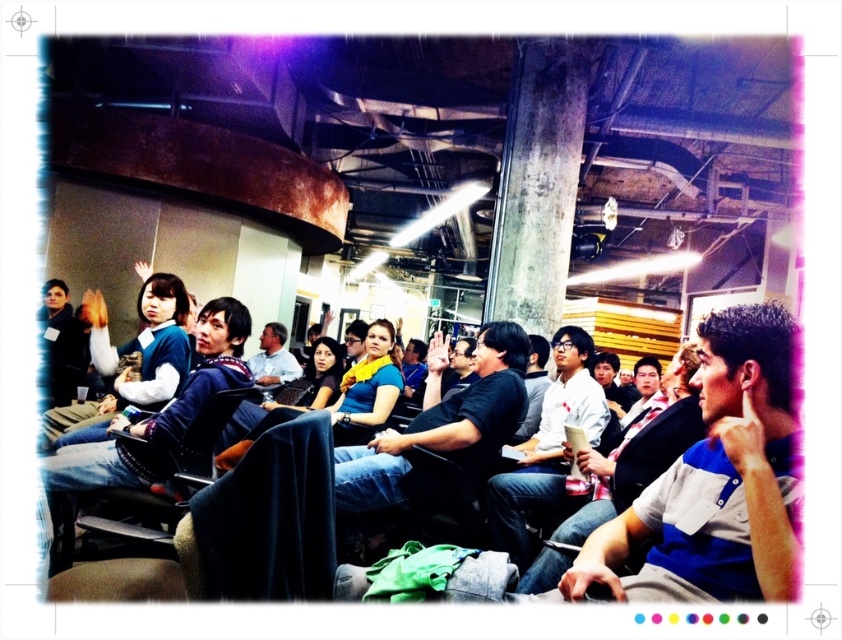
You are organizing a photo shoot and need to ensure that the black matte shirt at center and the white matte shirt at center are at least 20 inches apart for better visibility. Based on the current setup shown in the image, can they meet this requirement?

The black matte shirt at center and white matte shirt at center are 15.78 inches apart, which is less than the required 20 inches. They cannot meet the requirement in the current setup.